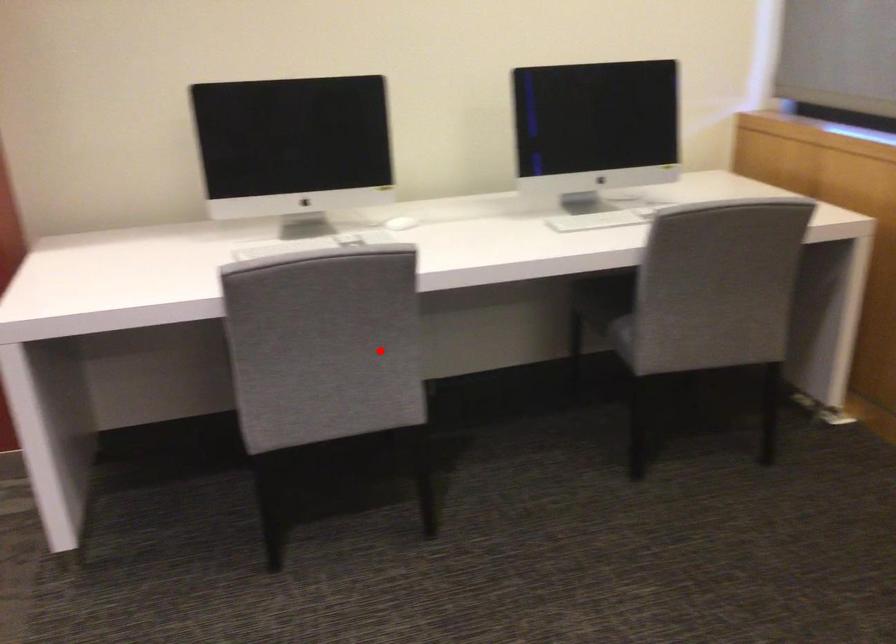
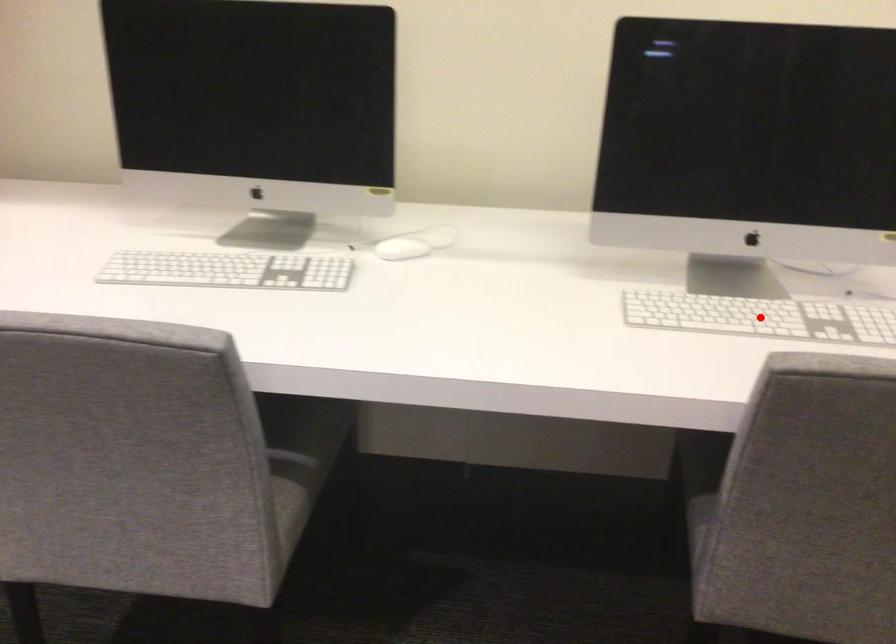
I am providing you with two images of the same scene from different viewpoints. A red point is marked on the first image and another point is marked on the second image. Does the point marked in image1 correspond to the same location as the one in image2?

No